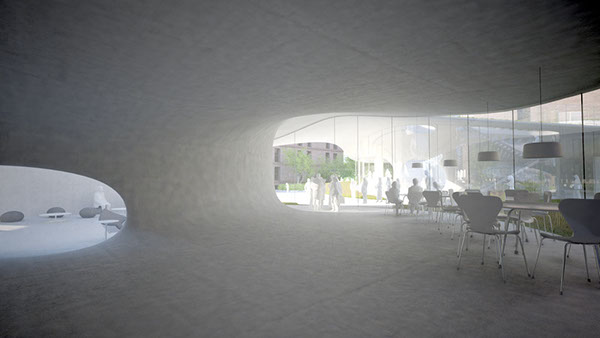
This screenshot has width=600, height=338. What are the coordinates of `light` in the screenshot? It's located at (545, 146), (491, 155), (448, 164), (423, 165).